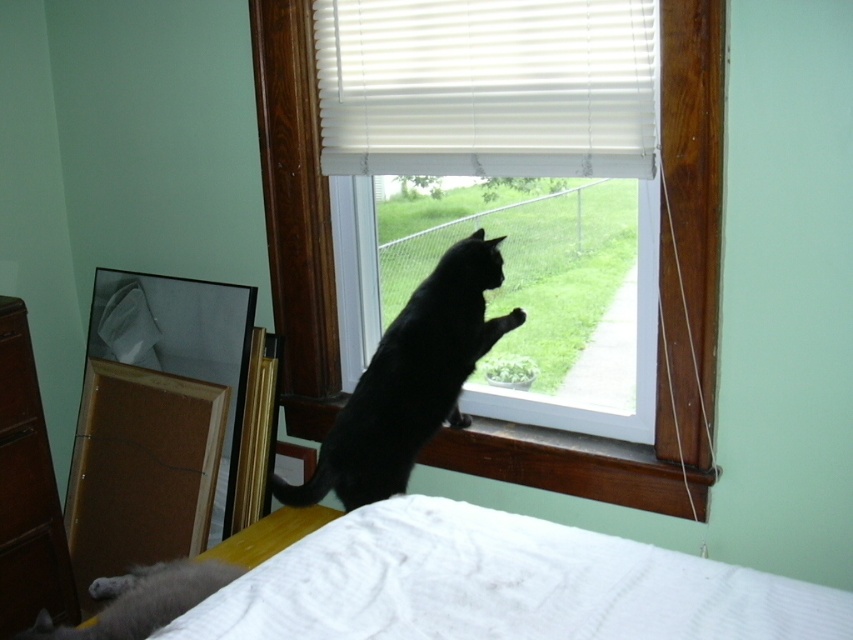
You are a delivery robot in the house. You need to navigate to the white textured bed at lower center. The room is a rectangle with coordinates from 0 to 1 on both axes. Your current position is at point 0.5,0.5. Can you reach the bed without moving beyond the room boundaries?

The white textured bed at lower center is at point (x=500, y=586). Since the room coordinates range from 0 to 1, and the bed is within those boundaries, the robot can reach it without moving beyond the room limits.